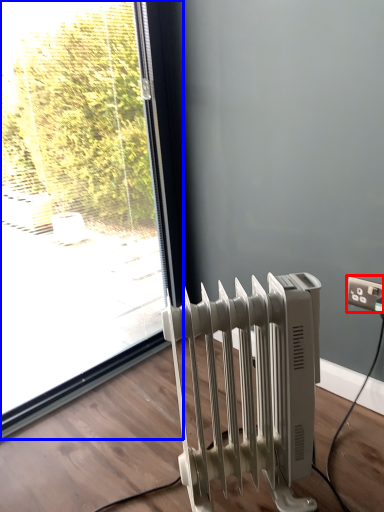
Question: Which of the following is the farthest to the observer, electric outlet (highlighted by a red box) or window (highlighted by a blue box)?

Choices:
 (A) electric outlet
 (B) window

Answer: (A)